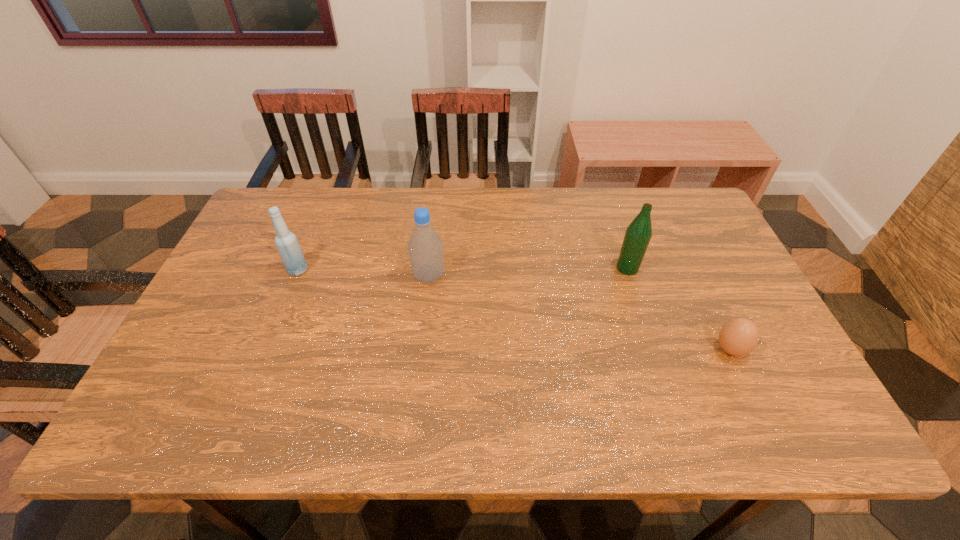
Find the location of a particular element. The width and height of the screenshot is (960, 540). the third object from right to left is located at coordinates (425, 247).

Where is `the rightmost bottle`? Image resolution: width=960 pixels, height=540 pixels. the rightmost bottle is located at coordinates (638, 234).

You are a GUI agent. You are given a task and a screenshot of the screen. Output one action in this format:
    pyautogui.click(x=<x>, y=<y>)
    Task: Click on the leftmost object
    
    Given the screenshot: What is the action you would take?
    pyautogui.click(x=286, y=242)

Image resolution: width=960 pixels, height=540 pixels. Identify the location of the rightmost object. (740, 336).

You are a GUI agent. You are given a task and a screenshot of the screen. Output one action in this format:
    pyautogui.click(x=<x>, y=<y>)
    Task: Click on the nearest object
    The image size is (960, 540).
    Given the screenshot: What is the action you would take?
    pyautogui.click(x=740, y=336)

This screenshot has width=960, height=540. What are the coordinates of `blank space located on the left of the second object from left to right` in the screenshot? It's located at (359, 276).

At what (x,y) coordinates should I click in order to perform the action: click on vacant area situated 0.060m on the right of the rightmost bottle. Please return your answer as a coordinate pair (x, y). Looking at the image, I should click on (660, 268).

Where is `free space located 0.280m on the front of the leftmost object`? free space located 0.280m on the front of the leftmost object is located at coordinates (261, 361).

Locate an element on the screen. blank space located on the left of the shortest object is located at coordinates (677, 349).

I want to click on object that is positioned at the right edge, so click(x=740, y=336).